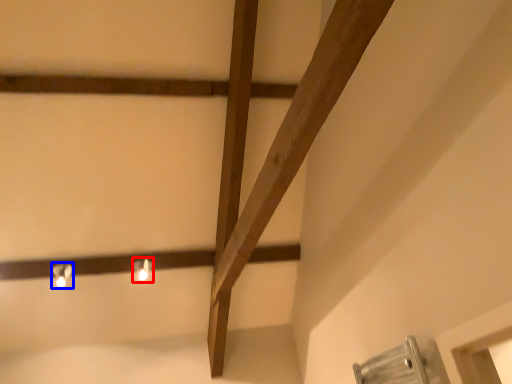
Question: Among these objects, which one is farthest to the camera, light fixture (highlighted by a red box) or light fixture (highlighted by a blue box)?

Choices:
 (A) light fixture
 (B) light fixture

Answer: (A)